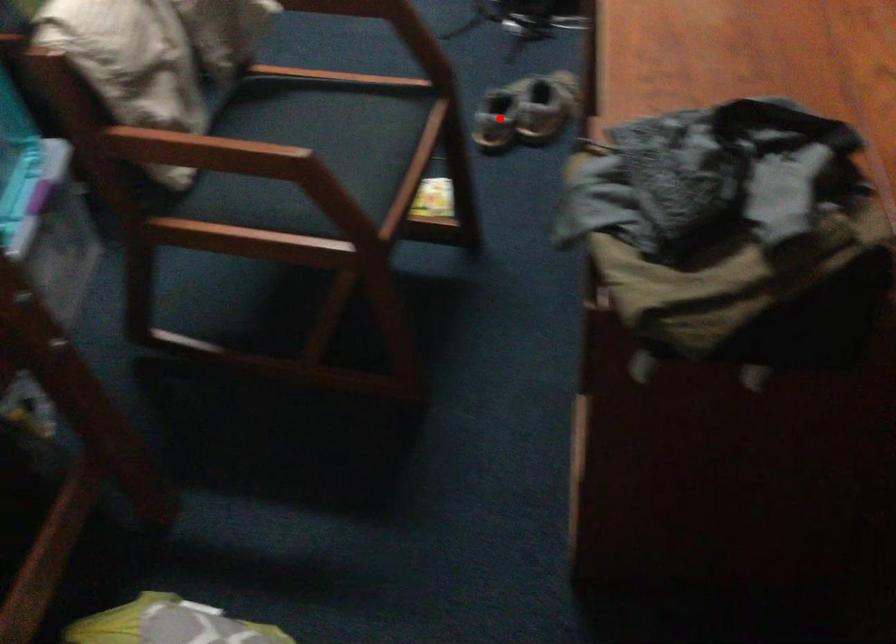
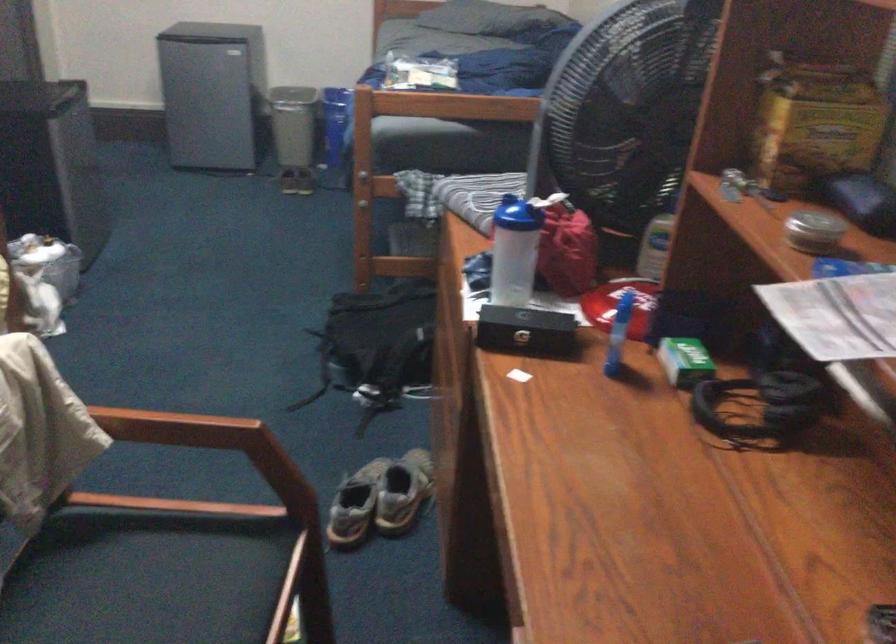
Where in the second image is the point corresponding to the highlighted location from the first image?

(355, 505)